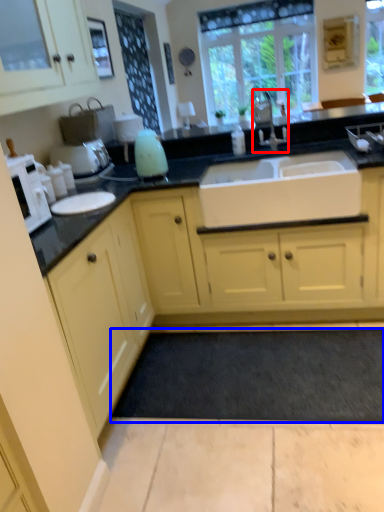
Question: Which of the following is the farthest to the observer, tap (highlighted by a red box) or plain (highlighted by a blue box)?

Choices:
 (A) tap
 (B) plain

Answer: (A)